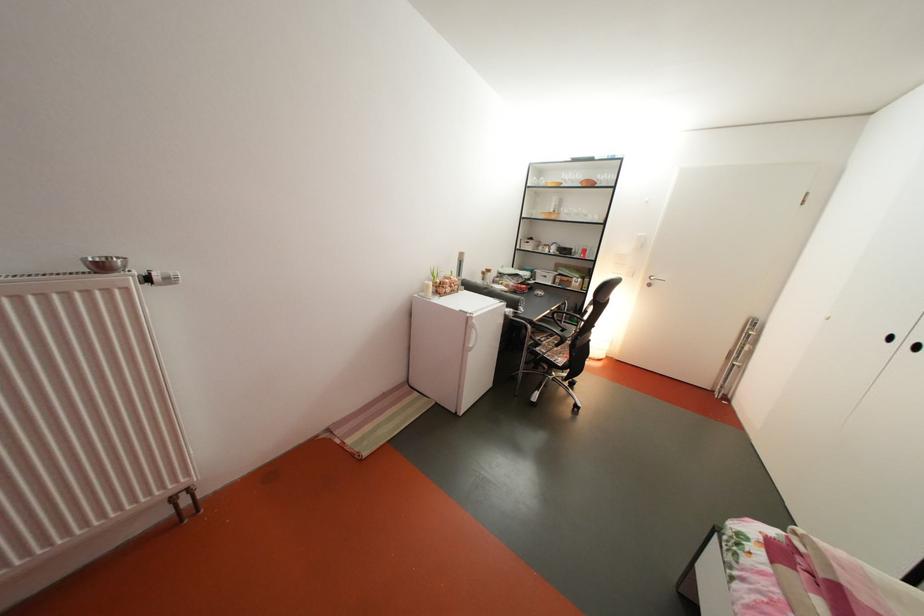
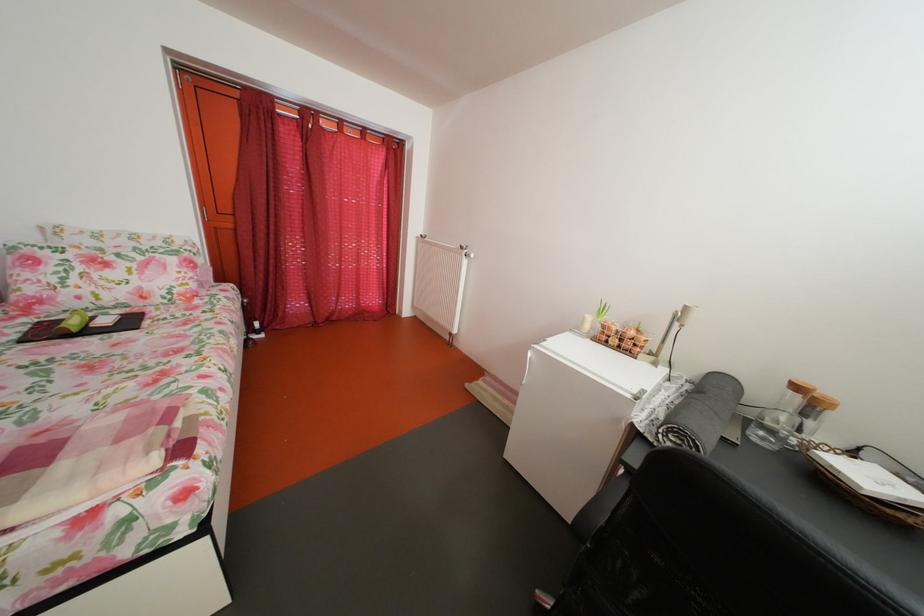
Where in the second image is the point corresponding to [115,274] from the first image?

(473, 254)